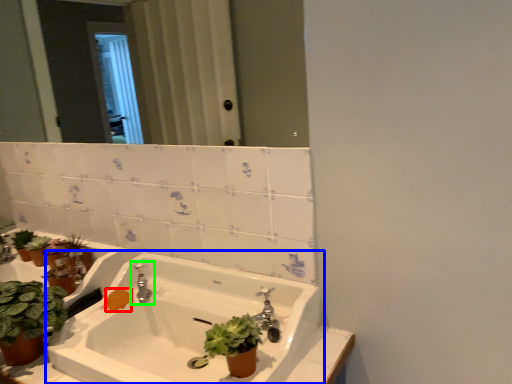
Question: Estimate the real-world distances between objects in this image. Which object is farther from soap (highlighted by a red box), sink (highlighted by a blue box) or tap (highlighted by a green box)?

Choices:
 (A) sink
 (B) tap

Answer: (A)